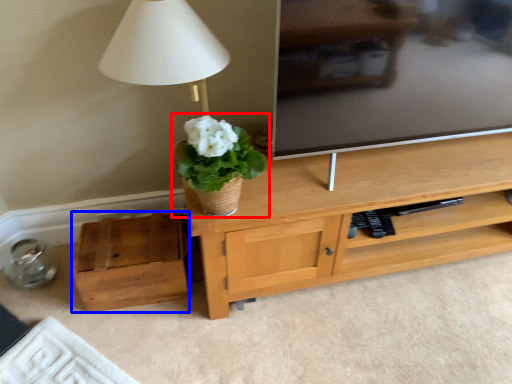
Question: Which object appears farthest to the camera in this image, houseplant (highlighted by a red box) or box (highlighted by a blue box)?

Choices:
 (A) houseplant
 (B) box

Answer: (B)